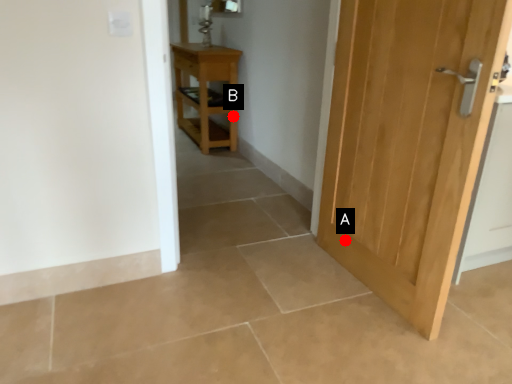
Question: Two points are circled on the image, labeled by A and B beside each circle. Which point appears closest to the camera in this image?

Choices:
 (A) A is closer
 (B) B is closer

Answer: (A)